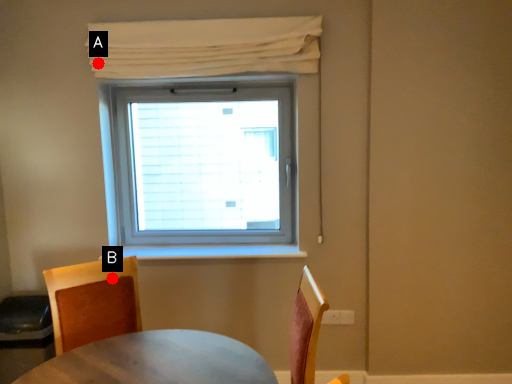
Question: Two points are circled on the image, labeled by A and B beside each circle. Which point appears farthest from the camera in this image?

Choices:
 (A) A is further
 (B) B is further

Answer: (A)